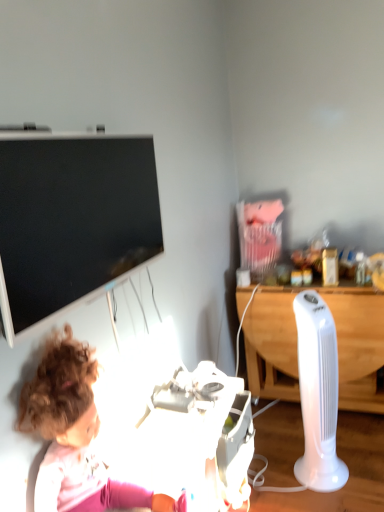
Question: Does curly-haired doll at lower left lie in front of white wood desk at right?

Choices:
 (A) no
 (B) yes

Answer: (B)

Question: From a real-world perspective, is curly-haired doll at lower left located higher than white wood desk at right?

Choices:
 (A) yes
 (B) no

Answer: (A)

Question: Is curly-haired doll at lower left shorter than white wood desk at right?

Choices:
 (A) no
 (B) yes

Answer: (B)

Question: Can you confirm if curly-haired doll at lower left is taller than white wood desk at right?

Choices:
 (A) no
 (B) yes

Answer: (A)

Question: Is curly-haired doll at lower left at the right side of white wood desk at right?

Choices:
 (A) no
 (B) yes

Answer: (A)

Question: Considering the relative positions of curly-haired doll at lower left and white wood desk at right in the image provided, is curly-haired doll at lower left to the left of white wood desk at right from the viewer's perspective?

Choices:
 (A) yes
 (B) no

Answer: (A)

Question: Can you confirm if white wood desk at right is smaller than curly-haired doll at lower left?

Choices:
 (A) no
 (B) yes

Answer: (A)

Question: Does white wood desk at right appear on the left side of curly-haired doll at lower left?

Choices:
 (A) no
 (B) yes

Answer: (A)

Question: Is white wood desk at right surrounding curly-haired doll at lower left?

Choices:
 (A) yes
 (B) no

Answer: (B)

Question: From a real-world perspective, is white wood desk at right physically below curly-haired doll at lower left?

Choices:
 (A) no
 (B) yes

Answer: (B)

Question: From a real-world perspective, does white wood desk at right stand above curly-haired doll at lower left?

Choices:
 (A) no
 (B) yes

Answer: (A)

Question: Considering the relative sizes of white wood desk at right and curly-haired doll at lower left in the image provided, is white wood desk at right shorter than curly-haired doll at lower left?

Choices:
 (A) no
 (B) yes

Answer: (A)

Question: Does white plastic fan at right, acting as the first equipment starting from the right, have a lesser height compared to black glossy television at upper left?

Choices:
 (A) yes
 (B) no

Answer: (B)